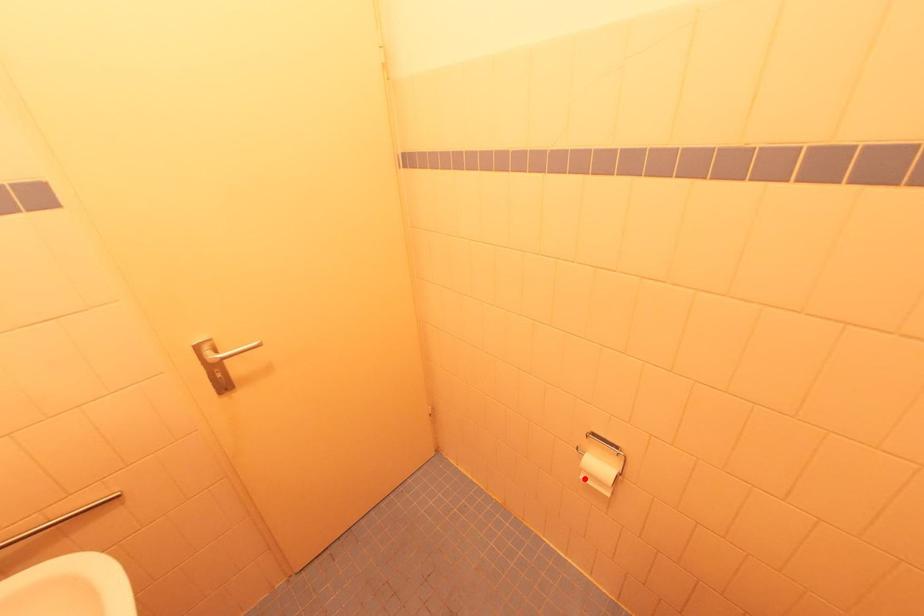
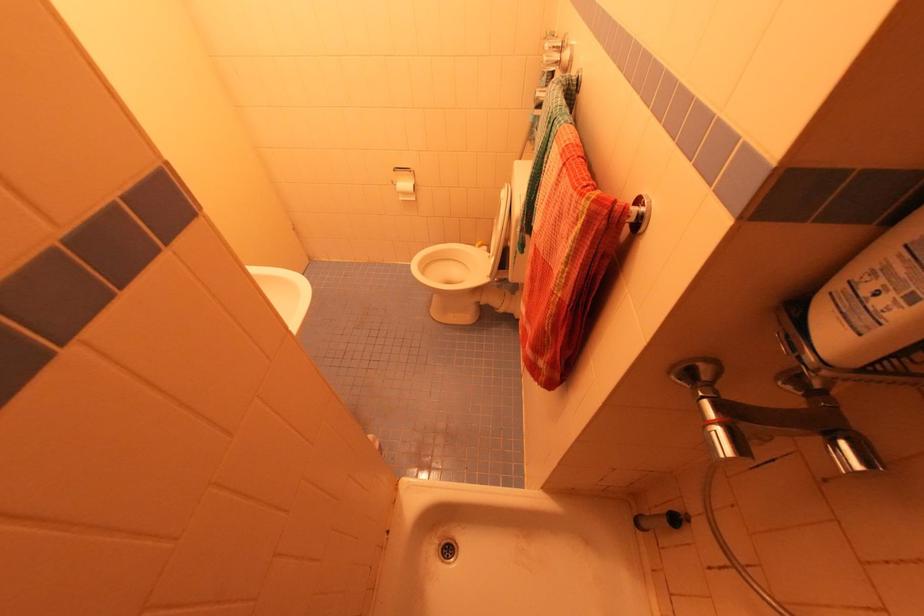
The point at the highlighted location is marked in the first image. Where is the corresponding point in the second image?

(403, 200)